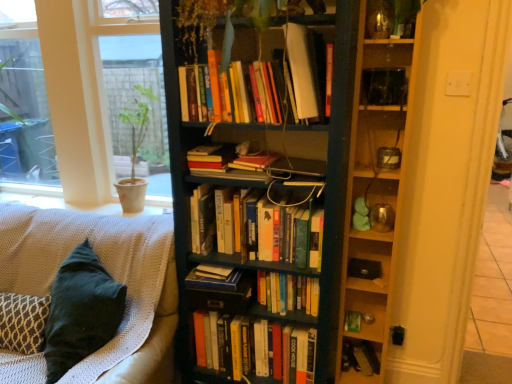
Where is `velvet teal pillow at lower left`? This screenshot has height=384, width=512. velvet teal pillow at lower left is located at coordinates (105, 267).

Describe the element at coordinates (288, 293) in the screenshot. I see `hardcover books at center, the fifth book in the top-to-bottom sequence` at that location.

Locate an element on the screen. The height and width of the screenshot is (384, 512). hardcover book at center, the third book from the bottom is located at coordinates (214, 280).

What is the approximate height of hardcover book at center, acting as the third book starting from the top?

3.69 centimeters.

Describe the element at coordinates (132, 91) in the screenshot. I see `matte beige pot at left` at that location.

At what (x,y) coordinates should I click in order to perform the action: click on green matte paperback book at lower right. Please return your answer as a coordinate pair (x, y). This screenshot has width=512, height=384. Looking at the image, I should click on (352, 321).

Locate an element on the screen. This screenshot has width=512, height=384. velvet teal pillow at lower left is located at coordinates (105, 267).

In the image, is hardcover books at center, arranged as the 7th book when ordered from the bottom, on the left side or the right side of matte beige pot at left?

hardcover books at center, arranged as the 7th book when ordered from the bottom, is to the right of matte beige pot at left.

Is hardcover books at center, arranged as the 7th book when ordered from the bottom, in front of matte beige pot at left?

Yes, the depth of hardcover books at center, arranged as the 7th book when ordered from the bottom, is less than that of matte beige pot at left.

Which is behind, point (226, 155) or point (106, 18)?

The point (106, 18) is more distant.

From the image's perspective, relative to hardcover book at center, the sixth book positioned from the top, is hardcover books at center, the fifth book in the top-to-bottom sequence, above or below?

hardcover books at center, the fifth book in the top-to-bottom sequence, is situated higher than hardcover book at center, the sixth book positioned from the top, in the image.

From the hardcover books at center, arranged as the fourth book when ordered from the bottom, count the 5th book to the left and point to it. Please provide its 2D coordinates.

[(214, 280)]

Is hardcover books at center, arranged as the fourth book when ordered from the bottom, positioned with its back to hardcover book at center, the sixth book positioned from the top?

No, hardcover books at center, arranged as the fourth book when ordered from the bottom,'s orientation is not away from hardcover book at center, the sixth book positioned from the top.

How different are the orientations of hardcover book at center, the sixth book in the bottom-to-top sequence, and hardcover books at center, the 8th book ordered from the bottom, in degrees?

They differ by 4.27 degrees in their facing directions.

Who is bigger, hardcover book at center, the sixth book in the bottom-to-top sequence, or hardcover books at center, the 8th book ordered from the bottom?

Bigger between the two is hardcover books at center, the 8th book ordered from the bottom.

Can you confirm if hardcover book at center, the sixth book in the bottom-to-top sequence, is wider than hardcover books at center, which is counted as the 1th book, starting from the top?

Yes.

Could you tell me if dark wood bookcase at center is facing green matte paperback book at lower right?

No, dark wood bookcase at center is not turned towards green matte paperback book at lower right.

Is point (223, 305) behind point (358, 325)?

No, it is in front of (358, 325).

From the image's perspective, between dark wood bookcase at center and green matte paperback book at lower right, who is located below?

green matte paperback book at lower right is shown below in the image.

Can you tell me how much dark wood bookcase at center and green matte paperback book at lower right differ in facing direction?

0.672 degrees.

Is hardcover books at center, acting as the 2th book starting from the top, to the right of hardcover book at center, the sixth book positioned from the top, from the viewer's perspective?

No, hardcover books at center, acting as the 2th book starting from the top, is not to the right of hardcover book at center, the sixth book positioned from the top.

Could you measure the distance between hardcover books at center, arranged as the 7th book when ordered from the bottom, and hardcover book at center, the sixth book positioned from the top?

hardcover books at center, arranged as the 7th book when ordered from the bottom, and hardcover book at center, the sixth book positioned from the top, are 18.92 inches apart from each other.

Is hardcover books at center, arranged as the 7th book when ordered from the bottom, oriented towards hardcover book at center, the sixth book positioned from the top?

No, hardcover books at center, arranged as the 7th book when ordered from the bottom, does not turn towards hardcover book at center, the sixth book positioned from the top.

From the image's perspective, is hardcover books at center, arranged as the 7th book when ordered from the bottom, located beneath hardcover book at center, the third book from the bottom?

Actually, hardcover books at center, arranged as the 7th book when ordered from the bottom, appears above hardcover book at center, the third book from the bottom, in the image.

Does hardcover book at center, the sixth book in the bottom-to-top sequence, come in front of hardcover book at lower right, which ranks as the 1th book in bottom-to-top order?

Result: Yes, it is in front of hardcover book at lower right, which ranks as the 1th book in bottom-to-top order.

From a real-world perspective, is hardcover book at center, the sixth book in the bottom-to-top sequence, over hardcover book at lower right, positioned as the 8th book in top-to-bottom order?

Indeed, from a real-world perspective, hardcover book at center, the sixth book in the bottom-to-top sequence, stands above hardcover book at lower right, positioned as the 8th book in top-to-bottom order.

Does hardcover book at center, the sixth book in the bottom-to-top sequence, have a greater height compared to hardcover book at lower right, positioned as the 8th book in top-to-bottom order?

Incorrect, the height of hardcover book at center, the sixth book in the bottom-to-top sequence, is not larger of that of hardcover book at lower right, positioned as the 8th book in top-to-bottom order.

From the image's perspective, is hardcover book at center, acting as the third book starting from the top, located above or below hardcover book at lower right, which ranks as the 1th book in bottom-to-top order?

From the image's perspective, hardcover book at center, acting as the third book starting from the top, appears above hardcover book at lower right, which ranks as the 1th book in bottom-to-top order.

How many degrees apart are the facing directions of hardcover books at center, arranged as the fourth book when ordered from the bottom, and wooden shelves at right?

There is a 0.326-degree angle between the facing directions of hardcover books at center, arranged as the fourth book when ordered from the bottom, and wooden shelves at right.

Is hardcover books at center, arranged as the fourth book when ordered from the bottom, far away from wooden shelves at right?

No, there isn't a large distance between hardcover books at center, arranged as the fourth book when ordered from the bottom, and wooden shelves at right.

From the image's perspective, which is above, hardcover books at center, arranged as the fourth book when ordered from the bottom, or wooden shelves at right?

wooden shelves at right, from the image's perspective.

Do you think hardcover books at center, the fifth book in the top-to-bottom sequence, is within wooden shelves at right, or outside of it?

hardcover books at center, the fifth book in the top-to-bottom sequence, is outside wooden shelves at right.

Where is `bay window that appears behind the hardcover books at center, acting as the 2th book starting from the top`? bay window that appears behind the hardcover books at center, acting as the 2th book starting from the top is located at coordinates (132, 91).

Locate an element on the screen. This screenshot has height=384, width=512. the 1st book positioned below the hardcover books at center, arranged as the fourth book when ordered from the bottom (from a real-world perspective) is located at coordinates (214, 280).

When comparing their distances from hardcover book at lower right, positioned as the 8th book in top-to-bottom order, does matte beige pot at left or hardcover books at center, arranged as the 7th book when ordered from the bottom, seem closer?

hardcover books at center, arranged as the 7th book when ordered from the bottom, is positioned closer to the anchor hardcover book at lower right, positioned as the 8th book in top-to-bottom order.

From the image, which object appears to be farther from matte beige pot at left, green matte paperback book at lower right or hardcover book at center, acting as the third book starting from the top?

Based on the image, green matte paperback book at lower right appears to be further to matte beige pot at left.

Which object lies nearer to the anchor point dark wood bookcase at center, hardcover books at center, the 8th book ordered from the bottom, or hardcover books at center, acting as the 2th book starting from the top?

hardcover books at center, the 8th book ordered from the bottom, lies closer to dark wood bookcase at center than the other object.

Estimate the real-world distances between objects in this image. Which object is further from hardcover books at center, which is counted as the 1th book, starting from the top, matte beige pot at left or hardcover books at center, arranged as the fifth book when ordered from the bottom?

matte beige pot at left lies further to hardcover books at center, which is counted as the 1th book, starting from the top, than the other object.

Looking at this image, when comparing their distances from wooden shelves at right, does hardcover books at center, which is counted as the 1th book, starting from the top, or hardcover book at lower right, which ranks as the 1th book in bottom-to-top order, seem closer?

Based on the image, hardcover books at center, which is counted as the 1th book, starting from the top, appears to be nearer to wooden shelves at right.

When comparing their distances from green matte paperback book at lower right, does wooden shelves at right or dark wood bookcase at center seem closer?

Among the two, wooden shelves at right is located nearer to green matte paperback book at lower right.

Based on the photo, considering their positions, is hardcover books at center, arranged as the fifth book when ordered from the bottom, positioned further to hardcover books at center, which is counted as the 7th book, starting from the top, than hardcover book at center, the sixth book in the bottom-to-top sequence?

The object further to hardcover books at center, which is counted as the 7th book, starting from the top, is hardcover book at center, the sixth book in the bottom-to-top sequence.

Based on the photo, when comparing their distances from hardcover books at center, which ranks as the 2th book in bottom-to-top order, does wooden shelves at right or hardcover books at center, arranged as the 7th book when ordered from the bottom, seem further?

The object further to hardcover books at center, which ranks as the 2th book in bottom-to-top order, is hardcover books at center, arranged as the 7th book when ordered from the bottom.

Locate an element on the screen. The image size is (512, 384). shelf between hardcover book at center, the sixth book in the bottom-to-top sequence, and hardcover books at center, which is counted as the 7th book, starting from the top, from top to bottom is located at coordinates (374, 187).

Identify the location of paperback book between hardcover book at center, acting as the third book starting from the top, and hardcover book at lower right, which ranks as the 1th book in bottom-to-top order, from top to bottom. The height and width of the screenshot is (384, 512). (352, 321).

I want to click on paperback book between hardcover books at center, which is the fourth book from top to bottom, and hardcover books at center, which is counted as the 7th book, starting from the top, from top to bottom, so click(352, 321).

In order to click on shelf between dark wood bookcase at center and hardcover books at center, which is counted as the 7th book, starting from the top, vertically in this screenshot , I will do `click(374, 187)`.